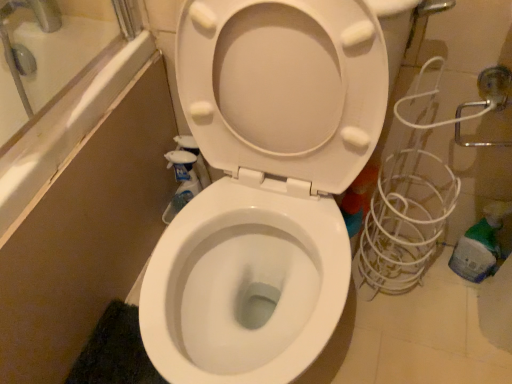
This screenshot has width=512, height=384. What do you see at coordinates (265, 183) in the screenshot?
I see `white glossy toilet at center` at bounding box center [265, 183].

This screenshot has width=512, height=384. Identify the location of white glossy toilet at center. (265, 183).

At what (x,y) coordinates should I click in order to perform the action: click on white glossy toilet at center. Please return your answer as a coordinate pair (x, y). The image size is (512, 384). Looking at the image, I should click on (265, 183).